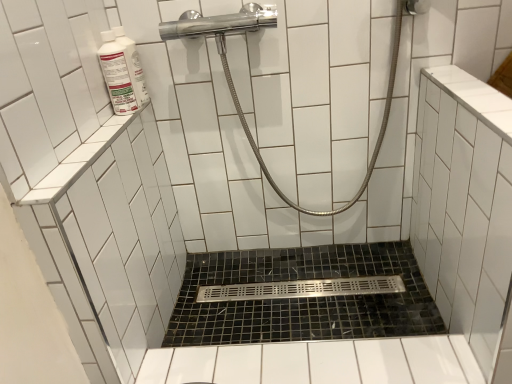
Question: From the image's perspective, is white glossy bottle at upper left, arranged as the second cleaning product when viewed from the back, on black mosaic tile bath at center?

Choices:
 (A) yes
 (B) no

Answer: (A)

Question: From the image's perspective, would you say white glossy bottle at upper left, the first cleaning product from the front, is shown under black mosaic tile bath at center?

Choices:
 (A) no
 (B) yes

Answer: (A)

Question: Considering the relative positions of white glossy bottle at upper left, arranged as the second cleaning product when viewed from the back, and black mosaic tile bath at center in the image provided, is white glossy bottle at upper left, arranged as the second cleaning product when viewed from the back, to the left of black mosaic tile bath at center from the viewer's perspective?

Choices:
 (A) no
 (B) yes

Answer: (B)

Question: Does white glossy bottle at upper left, the first cleaning product from the front, come in front of black mosaic tile bath at center?

Choices:
 (A) yes
 (B) no

Answer: (A)

Question: Is white glossy bottle at upper left, the first cleaning product from the front, smaller than black mosaic tile bath at center?

Choices:
 (A) yes
 (B) no

Answer: (A)

Question: Is white glossy bottle at upper left, arranged as the second cleaning product when viewed from the back, turned away from black mosaic tile bath at center?

Choices:
 (A) yes
 (B) no

Answer: (B)

Question: From a real-world perspective, is white glossy bottle at upper left, the 1th cleaning product positioned from the back, physically below polished chrome showerhead at upper center?

Choices:
 (A) no
 (B) yes

Answer: (A)

Question: Can you confirm if white glossy bottle at upper left, which is the 2th cleaning product from front to back, is shorter than polished chrome showerhead at upper center?

Choices:
 (A) yes
 (B) no

Answer: (A)

Question: From the image's perspective, is white glossy bottle at upper left, the 1th cleaning product positioned from the back, on top of polished chrome showerhead at upper center?

Choices:
 (A) yes
 (B) no

Answer: (A)

Question: Considering the relative sizes of white glossy bottle at upper left, which is the 2th cleaning product from front to back, and polished chrome showerhead at upper center in the image provided, is white glossy bottle at upper left, which is the 2th cleaning product from front to back, wider than polished chrome showerhead at upper center?

Choices:
 (A) yes
 (B) no

Answer: (B)

Question: Is the depth of white glossy bottle at upper left, which is the 2th cleaning product from front to back, greater than that of polished chrome showerhead at upper center?

Choices:
 (A) no
 (B) yes

Answer: (B)

Question: Does black mosaic tile bath at center have a lesser width compared to white glossy bottle at upper left, the 1th cleaning product positioned from the back?

Choices:
 (A) no
 (B) yes

Answer: (A)